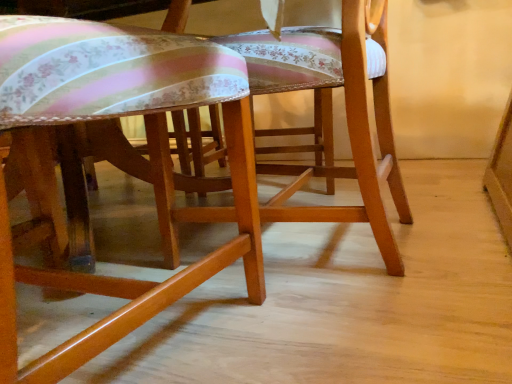
What do you see at coordinates (115, 116) in the screenshot?
I see `matte wood chair at center, acting as the second chair starting from the right` at bounding box center [115, 116].

What is the approximate height of matte wood chair at center, acting as the second chair starting from the right?

It is 23.65 inches.

Locate an element on the screen. Image resolution: width=512 pixels, height=384 pixels. matte wood chair at center, the 1th chair in the left-to-right sequence is located at coordinates (115, 116).

In order to face wooden chair at center, the 2th chair when ordered from left to right, should I rotate leftwards or rightwards?

To face it directly, rotate right by 7.540 degrees.

Describe the element at coordinates (331, 115) in the screenshot. I see `wooden chair at center, the 2th chair when ordered from left to right` at that location.

What is the approximate width of wooden chair at center, the 2th chair when ordered from left to right?

17.16 inches.

Locate an element on the screen. The width and height of the screenshot is (512, 384). wooden chair at center, the 2th chair when ordered from left to right is located at coordinates (331, 115).

Where is `matte wood chair at center, acting as the second chair starting from the right`? matte wood chair at center, acting as the second chair starting from the right is located at coordinates (115, 116).

Which object is positioned more to the left, wooden chair at center, placed as the 1th chair when sorted from right to left, or matte wood chair at center, acting as the second chair starting from the right?

From the viewer's perspective, matte wood chair at center, acting as the second chair starting from the right, appears more on the left side.

Which object is further away from the camera taking this photo, wooden chair at center, the 2th chair when ordered from left to right, or matte wood chair at center, the 1th chair in the left-to-right sequence?

wooden chair at center, the 2th chair when ordered from left to right, is more distant.

Between point (381, 99) and point (96, 25), which one is positioned in front?

The point (96, 25) is in front.

In the scene shown: From the image's perspective, is wooden chair at center, the 2th chair when ordered from left to right, below matte wood chair at center, acting as the second chair starting from the right?

Incorrect, from the image's perspective, wooden chair at center, the 2th chair when ordered from left to right, is higher than matte wood chair at center, acting as the second chair starting from the right.

From a real-world perspective, which object rests below the other?

wooden chair at center, placed as the 1th chair when sorted from right to left.

Does wooden chair at center, the 2th chair when ordered from left to right, have a lesser width compared to matte wood chair at center, acting as the second chair starting from the right?

Correct, the width of wooden chair at center, the 2th chair when ordered from left to right, is less than that of matte wood chair at center, acting as the second chair starting from the right.

Does wooden chair at center, placed as the 1th chair when sorted from right to left, have a lesser height compared to matte wood chair at center, acting as the second chair starting from the right?

No, wooden chair at center, placed as the 1th chair when sorted from right to left, is not shorter than matte wood chair at center, acting as the second chair starting from the right.

Is wooden chair at center, the 2th chair when ordered from left to right, smaller than matte wood chair at center, the 1th chair in the left-to-right sequence?

Yes.

Is wooden chair at center, placed as the 1th chair when sorted from right to left, not inside matte wood chair at center, the 1th chair in the left-to-right sequence?

Yes, wooden chair at center, placed as the 1th chair when sorted from right to left, is located beyond the bounds of matte wood chair at center, the 1th chair in the left-to-right sequence.

Are wooden chair at center, the 2th chair when ordered from left to right, and matte wood chair at center, the 1th chair in the left-to-right sequence, beside each other?

No, wooden chair at center, the 2th chair when ordered from left to right, is not with matte wood chair at center, the 1th chair in the left-to-right sequence.

Could you tell me if wooden chair at center, placed as the 1th chair when sorted from right to left, is facing matte wood chair at center, the 1th chair in the left-to-right sequence?

No, wooden chair at center, placed as the 1th chair when sorted from right to left, does not turn towards matte wood chair at center, the 1th chair in the left-to-right sequence.

How different are the orientations of wooden chair at center, the 2th chair when ordered from left to right, and matte wood chair at center, the 1th chair in the left-to-right sequence, in degrees?

The facing directions of wooden chair at center, the 2th chair when ordered from left to right, and matte wood chair at center, the 1th chair in the left-to-right sequence, are 88.6 degrees apart.

Measure the distance from wooden chair at center, placed as the 1th chair when sorted from right to left, to matte wood chair at center, the 1th chair in the left-to-right sequence.

wooden chair at center, placed as the 1th chair when sorted from right to left, and matte wood chair at center, the 1th chair in the left-to-right sequence, are 12.13 inches apart from each other.

Locate an element on the screen. This screenshot has width=512, height=384. chair in front of the wooden chair at center, placed as the 1th chair when sorted from right to left is located at coordinates (115, 116).

Between matte wood chair at center, acting as the second chair starting from the right, and wooden chair at center, placed as the 1th chair when sorted from right to left, which one appears on the left side from the viewer's perspective?

Positioned to the left is matte wood chair at center, acting as the second chair starting from the right.

Considering the relative positions of matte wood chair at center, the 1th chair in the left-to-right sequence, and wooden chair at center, the 2th chair when ordered from left to right, in the image provided, is matte wood chair at center, the 1th chair in the left-to-right sequence, behind wooden chair at center, the 2th chair when ordered from left to right,?

No, it is not.

Which point is more distant from viewer, (x=98, y=333) or (x=361, y=100)?

The point (x=361, y=100) is behind.

From the image's perspective, between matte wood chair at center, the 1th chair in the left-to-right sequence, and wooden chair at center, the 2th chair when ordered from left to right, who is located below?

matte wood chair at center, the 1th chair in the left-to-right sequence.

From a real-world perspective, is matte wood chair at center, the 1th chair in the left-to-right sequence, positioned above or below wooden chair at center, placed as the 1th chair when sorted from right to left?

In terms of real-world spatial position, matte wood chair at center, the 1th chair in the left-to-right sequence, is above wooden chair at center, placed as the 1th chair when sorted from right to left.

Is matte wood chair at center, the 1th chair in the left-to-right sequence, wider than wooden chair at center, placed as the 1th chair when sorted from right to left?

Yes, matte wood chair at center, the 1th chair in the left-to-right sequence, is wider than wooden chair at center, placed as the 1th chair when sorted from right to left.

Considering the relative sizes of matte wood chair at center, the 1th chair in the left-to-right sequence, and wooden chair at center, the 2th chair when ordered from left to right, in the image provided, is matte wood chair at center, the 1th chair in the left-to-right sequence, taller than wooden chair at center, the 2th chair when ordered from left to right,?

In fact, matte wood chair at center, the 1th chair in the left-to-right sequence, may be shorter than wooden chair at center, the 2th chair when ordered from left to right.

Considering the sizes of objects matte wood chair at center, the 1th chair in the left-to-right sequence, and wooden chair at center, the 2th chair when ordered from left to right, in the image provided, who is smaller, matte wood chair at center, the 1th chair in the left-to-right sequence, or wooden chair at center, the 2th chair when ordered from left to right,?

wooden chair at center, the 2th chair when ordered from left to right.

Consider the image. Is matte wood chair at center, acting as the second chair starting from the right, surrounding wooden chair at center, placed as the 1th chair when sorted from right to left?

No, wooden chair at center, placed as the 1th chair when sorted from right to left, is located outside of matte wood chair at center, acting as the second chair starting from the right.

Are matte wood chair at center, acting as the second chair starting from the right, and wooden chair at center, the 2th chair when ordered from left to right, beside each other?

No, matte wood chair at center, acting as the second chair starting from the right, is not with wooden chair at center, the 2th chair when ordered from left to right.

Is matte wood chair at center, acting as the second chair starting from the right, oriented towards wooden chair at center, the 2th chair when ordered from left to right?

Yes, matte wood chair at center, acting as the second chair starting from the right, is aimed at wooden chair at center, the 2th chair when ordered from left to right.

Measure the distance between matte wood chair at center, acting as the second chair starting from the right, and wooden chair at center, placed as the 1th chair when sorted from right to left.

The distance of matte wood chair at center, acting as the second chair starting from the right, from wooden chair at center, placed as the 1th chair when sorted from right to left, is 12.13 inches.

Where is `chair on the right of matte wood chair at center, acting as the second chair starting from the right`? chair on the right of matte wood chair at center, acting as the second chair starting from the right is located at coordinates (331, 115).

This screenshot has height=384, width=512. There is a wooden chair at center, the 2th chair when ordered from left to right. Find the location of `chair above it (from a real-world perspective)`. chair above it (from a real-world perspective) is located at coordinates (115, 116).

Image resolution: width=512 pixels, height=384 pixels. What are the coordinates of `chair that appears behind the matte wood chair at center, acting as the second chair starting from the right` in the screenshot? It's located at (331, 115).